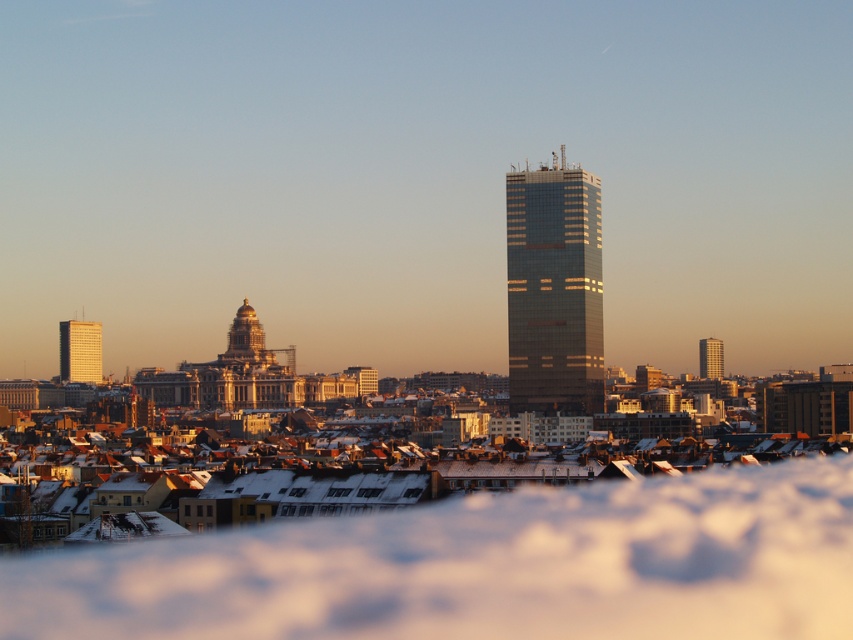
Question: Is gold dome at center further to camera compared to metallic glass tower at right?

Choices:
 (A) yes
 (B) no

Answer: (B)

Question: Which of these objects is positioned closest to the gold dome at center?

Choices:
 (A) metallic glass tower at right
 (B) gold reflective tower at left

Answer: (B)

Question: Is gold reflective tower at left positioned in front of gold dome at center?

Choices:
 (A) no
 (B) yes

Answer: (A)

Question: Is gold reflective tower at left positioned behind gold dome at center?

Choices:
 (A) yes
 (B) no

Answer: (A)

Question: Estimate the real-world distances between objects in this image. Which object is farther from the metallic glass tower at right?

Choices:
 (A) gold reflective tower at left
 (B) glassy metallic skyscraper at center
 (C) gold dome at center

Answer: (A)

Question: Among these objects, which one is farthest from the camera?

Choices:
 (A) metallic glass tower at right
 (B) gold dome at center
 (C) gold reflective tower at left
 (D) glassy metallic skyscraper at center

Answer: (C)